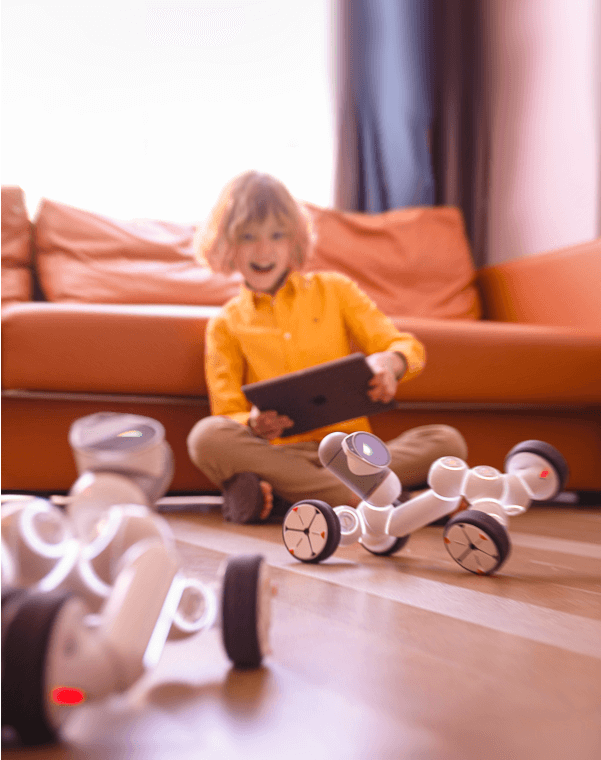
Find the location of a particular element. Image resolution: width=601 pixels, height=760 pixels. sofa cushion is located at coordinates (410, 258), (468, 356), (154, 369), (13, 268), (138, 264).